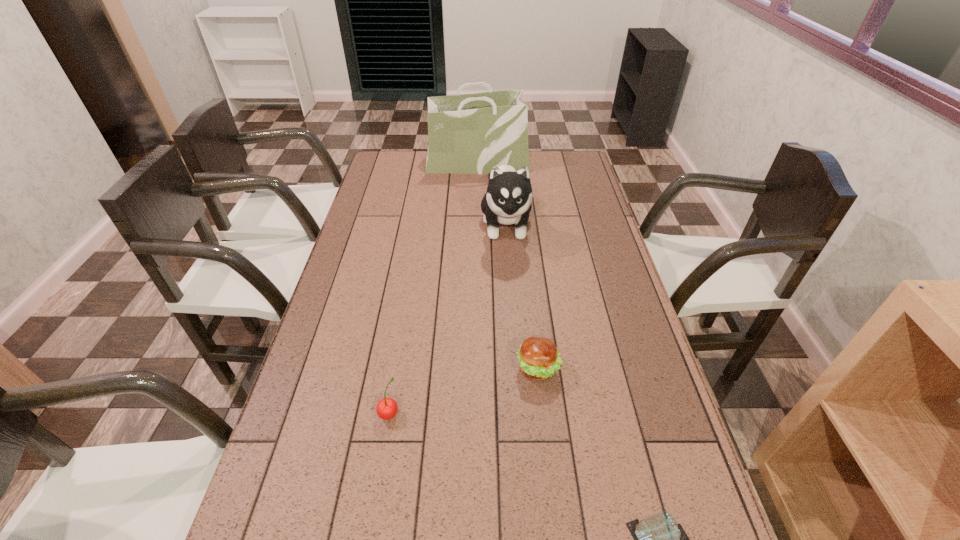
At what (x,y) coordinates should I click in order to perform the action: click on object at the far edge. Please return your answer as a coordinate pair (x, y). Looking at the image, I should click on (470, 133).

Where is `free region at the left edge`? This screenshot has height=540, width=960. free region at the left edge is located at coordinates (324, 357).

You are a GUI agent. You are given a task and a screenshot of the screen. Output one action in this format:
    pyautogui.click(x=<x>, y=<y>)
    Task: Click on the free region at the right edge of the desktop
    The height and width of the screenshot is (540, 960).
    Given the screenshot: What is the action you would take?
    pyautogui.click(x=588, y=340)

You are a GUI agent. You are given a task and a screenshot of the screen. Output one action in this format:
    pyautogui.click(x=<x>, y=<y>)
    Task: Click on the free space at the far left corner of the desktop
    The width and height of the screenshot is (960, 540).
    Given the screenshot: What is the action you would take?
    pyautogui.click(x=405, y=174)

This screenshot has width=960, height=540. I want to click on vacant space at the far right corner of the desktop, so click(580, 156).

I want to click on empty location between the fourth farthest object and the second farthest object, so click(447, 319).

Find the location of a particular element. Image resolution: width=960 pixels, height=540 pixels. empty location between the fourth farthest object and the fourth shortest object is located at coordinates (447, 319).

Locate an element on the screen. The image size is (960, 540). empty space that is in between the second nearest object and the fourth shortest object is located at coordinates (447, 319).

The image size is (960, 540). I want to click on unoccupied area between the hamburger and the tallest object, so click(x=508, y=266).

The image size is (960, 540). Find the location of `free space that is in between the puppy and the second nearest object`. free space that is in between the puppy and the second nearest object is located at coordinates (447, 319).